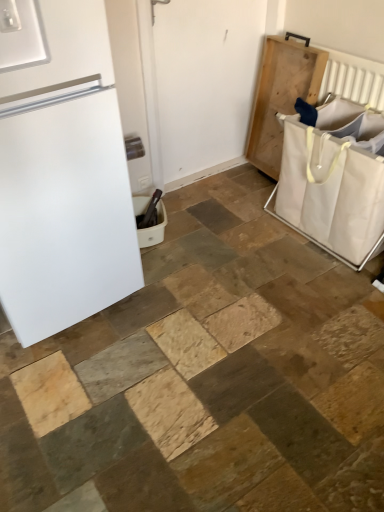
Question: Which direction should I rotate to face white plastic laundry basket at lower center, marked as the 2th laundry basket in a right-to-left arrangement, — up or down?

Choices:
 (A) down
 (B) up

Answer: (B)

Question: From a real-world perspective, is white plastic laundry basket at lower center, placed as the 1th laundry basket when sorted from left to right, over white canvas laundry basket at right, which ranks as the 1th laundry basket in right-to-left order?

Choices:
 (A) no
 (B) yes

Answer: (A)

Question: Does white plastic laundry basket at lower center, placed as the 1th laundry basket when sorted from left to right, contain white canvas laundry basket at right, arranged as the second laundry basket when viewed from the left?

Choices:
 (A) yes
 (B) no

Answer: (B)

Question: Is white plastic laundry basket at lower center, placed as the 1th laundry basket when sorted from left to right, far away from white canvas laundry basket at right, which ranks as the 1th laundry basket in right-to-left order?

Choices:
 (A) yes
 (B) no

Answer: (B)

Question: Considering the relative sizes of white plastic laundry basket at lower center, placed as the 1th laundry basket when sorted from left to right, and white canvas laundry basket at right, which ranks as the 1th laundry basket in right-to-left order, in the image provided, is white plastic laundry basket at lower center, placed as the 1th laundry basket when sorted from left to right, taller than white canvas laundry basket at right, which ranks as the 1th laundry basket in right-to-left order,?

Choices:
 (A) yes
 (B) no

Answer: (B)

Question: Is white plastic laundry basket at lower center, placed as the 1th laundry basket when sorted from left to right, in front of white canvas laundry basket at right, which ranks as the 1th laundry basket in right-to-left order?

Choices:
 (A) yes
 (B) no

Answer: (B)

Question: Is white plastic laundry basket at lower center, placed as the 1th laundry basket when sorted from left to right, not inside white canvas laundry basket at right, which ranks as the 1th laundry basket in right-to-left order?

Choices:
 (A) yes
 (B) no

Answer: (A)

Question: From a real-world perspective, does white matte refrigerator at left stand above white matte screen door at center?

Choices:
 (A) no
 (B) yes

Answer: (B)

Question: Is white matte refrigerator at left turned away from white matte screen door at center?

Choices:
 (A) no
 (B) yes

Answer: (A)

Question: Is white matte refrigerator at left outside of white matte screen door at center?

Choices:
 (A) yes
 (B) no

Answer: (A)

Question: From the image's perspective, is white matte refrigerator at left located above white matte screen door at center?

Choices:
 (A) no
 (B) yes

Answer: (A)

Question: Does white matte refrigerator at left have a greater width compared to white matte screen door at center?

Choices:
 (A) no
 (B) yes

Answer: (B)

Question: Is the position of white matte refrigerator at left more distant than that of white matte screen door at center?

Choices:
 (A) no
 (B) yes

Answer: (A)

Question: Is white matte refrigerator at left oriented towards natural wood tray at right?

Choices:
 (A) no
 (B) yes

Answer: (A)